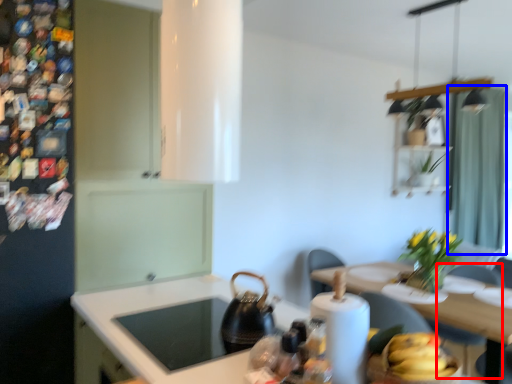
Question: Among these objects, which one is nearest to the camera, chair (highlighted by a red box) or curtain (highlighted by a blue box)?

Choices:
 (A) chair
 (B) curtain

Answer: (A)